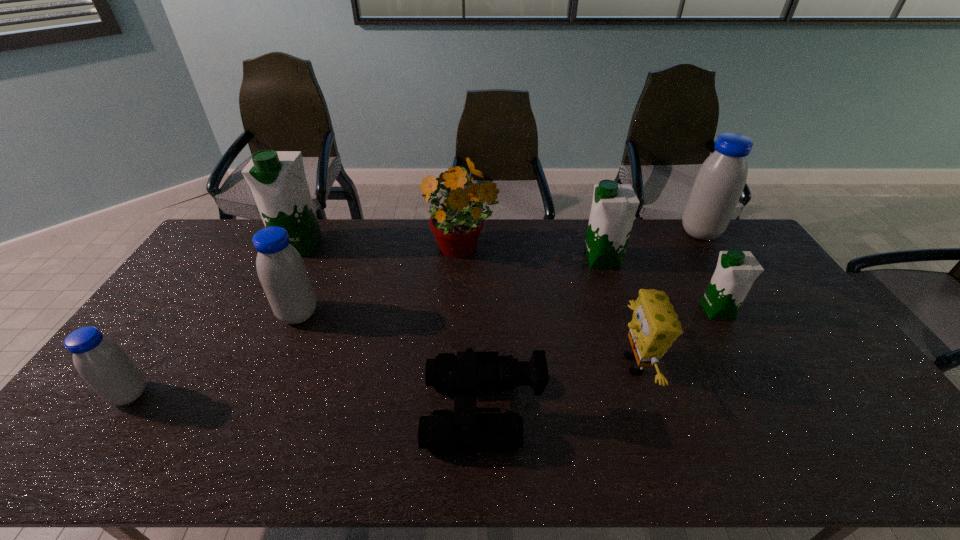
Identify the location of the rightmost blue soya milk. The width and height of the screenshot is (960, 540). click(x=719, y=183).

Image resolution: width=960 pixels, height=540 pixels. I want to click on the farthest blue soya milk, so click(x=719, y=183).

Where is `the biggest green soya milk`? The height and width of the screenshot is (540, 960). the biggest green soya milk is located at coordinates (277, 179).

The image size is (960, 540). I want to click on red flowerpot, so pyautogui.click(x=456, y=226).

Find the location of `the third soya milk from right to left`. the third soya milk from right to left is located at coordinates (614, 206).

Find the location of a particular element. the second green soya milk from right to left is located at coordinates (614, 206).

At what (x,y) coordinates should I click in order to perform the action: click on the second nearest blue soya milk. Please return your answer as a coordinate pair (x, y). Looking at the image, I should click on (281, 270).

Locate an element on the screen. This screenshot has height=540, width=960. the second biggest blue soya milk is located at coordinates (281, 270).

Locate an element on the screen. This screenshot has height=540, width=960. the nearest green soya milk is located at coordinates (736, 271).

The image size is (960, 540). Find the location of `the rightmost green soya milk`. the rightmost green soya milk is located at coordinates (736, 271).